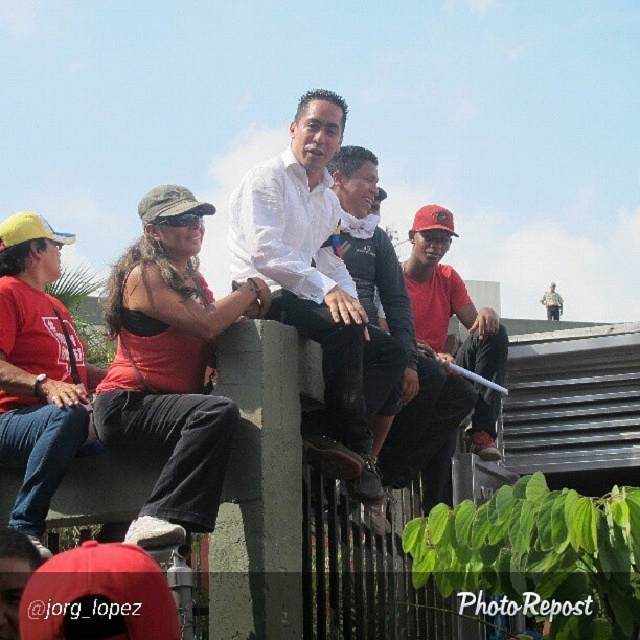
Can you confirm if white cotton shirt at center is thinner than matte red shirt at left?

No.

Does white cotton shirt at center lie in front of matte red shirt at left?

No, white cotton shirt at center is further to the viewer.

Measure the distance between point (230, 244) and camera.

The distance of point (230, 244) from camera is 103.98 meters.

Identify the location of white cotton shirt at center. The image size is (640, 640). (307, 260).

Is matte red shirt at left thinner than matte black shirt at center?

Incorrect, matte red shirt at left's width is not less than matte black shirt at center's.

Who is shorter, matte red shirt at left or matte black shirt at center?

With less height is matte red shirt at left.

Is point (36, 436) positioned behind point (342, 227)?

No, it is in front of (342, 227).

The width and height of the screenshot is (640, 640). I want to click on matte red shirt at left, so click(x=38, y=371).

Based on the photo, between matte red shirt at center and matte black shirt at center, which one has more height?

Standing taller between the two is matte black shirt at center.

Where is `matte red shirt at center`? The height and width of the screenshot is (640, 640). matte red shirt at center is located at coordinates (442, 369).

Does point (435, 481) come behind point (372, 241)?

No.

Identify the location of matte red shirt at center. (442, 369).